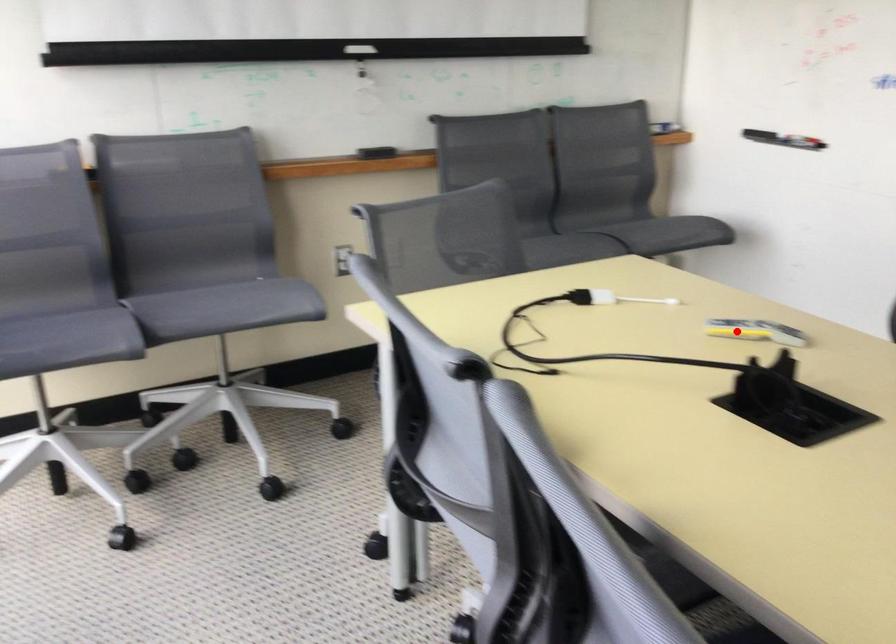
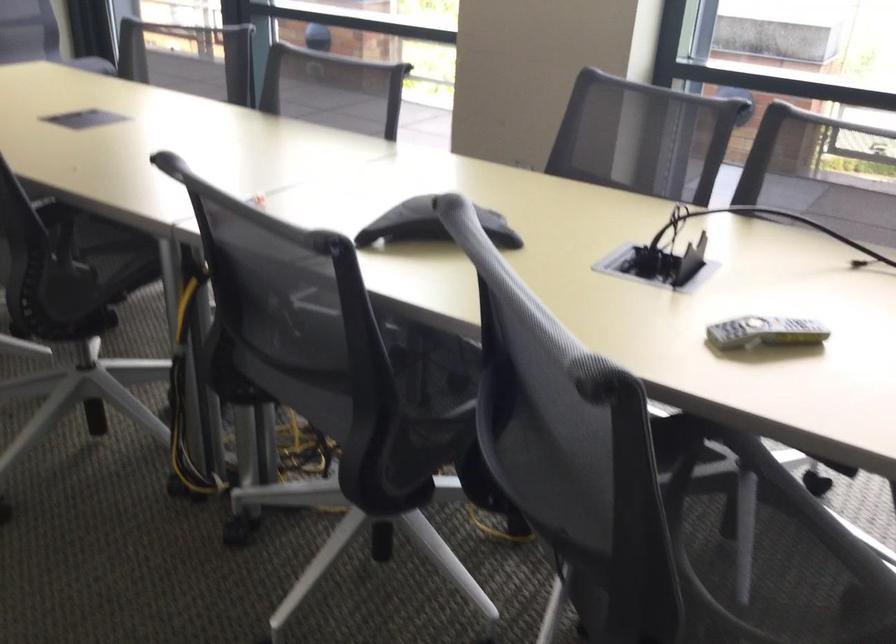
Question: I am providing you with two images of the same scene from different viewpoints. Image1 has a red point marked. In image2, the corresponding 3D location appears at what relative position? Reply with the corresponding letter.

Choices:
 (A) Closer
 (B) Farther

Answer: (A)